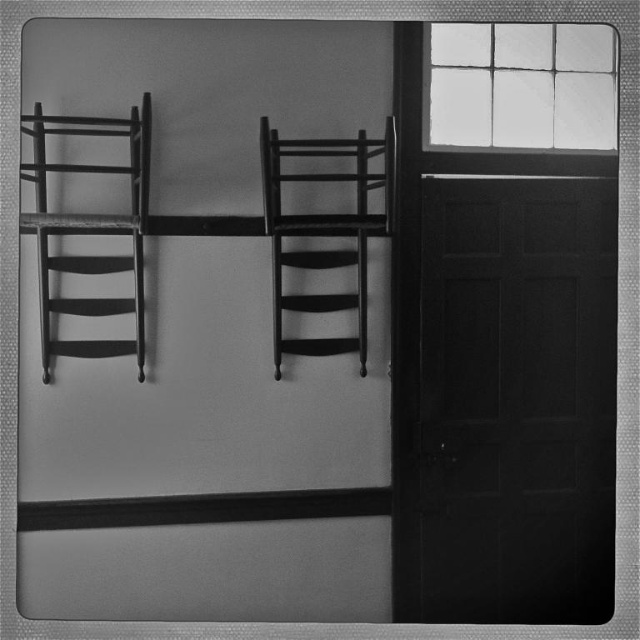
Is smooth black door at right bigger than smooth dark wood chair at center?

Actually, smooth black door at right might be smaller than smooth dark wood chair at center.

Where is `smooth black door at right`? Image resolution: width=640 pixels, height=640 pixels. smooth black door at right is located at coordinates (516, 397).

Who is taller, smooth black door at right or glass paneled window at upper right?

smooth black door at right is taller.

Is smooth black door at right shorter than glass paneled window at upper right?

No, smooth black door at right is not shorter than glass paneled window at upper right.

Image resolution: width=640 pixels, height=640 pixels. What do you see at coordinates (516, 397) in the screenshot? I see `smooth black door at right` at bounding box center [516, 397].

Identify the location of smooth black door at right. (516, 397).

Can you confirm if smooth dark wood chair at center is shorter than wooden chair at left?

Indeed, smooth dark wood chair at center has a lesser height compared to wooden chair at left.

Which is in front, point (273, 179) or point (109, 122)?

Point (273, 179) is more forward.

The width and height of the screenshot is (640, 640). I want to click on smooth dark wood chair at center, so (x=324, y=230).